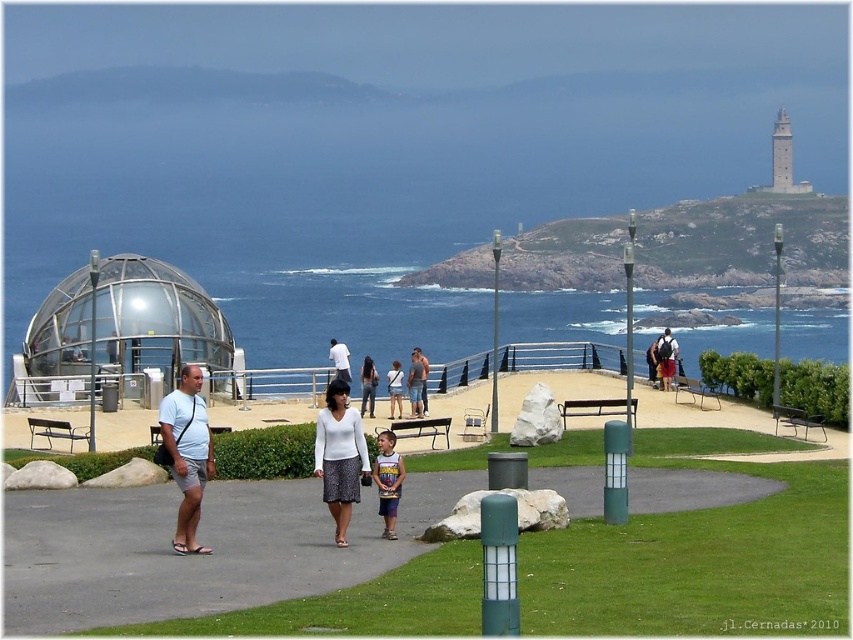
Which is more to the right, white matte sweater at center or striped t-shirt at center?

Positioned to the right is striped t-shirt at center.

Does white matte sweater at center come behind striped t-shirt at center?

No.

Between point (332, 429) and point (399, 472), which one is positioned in front?

Positioned in front is point (399, 472).

Locate an element on the screen. Image resolution: width=853 pixels, height=640 pixels. white matte sweater at center is located at coordinates (339, 456).

Which is in front, point (183, 472) or point (381, 467)?

Point (183, 472)

Is point (184, 512) farther from camera compared to point (393, 461)?

That is False.

You are a GUI agent. You are given a task and a screenshot of the screen. Output one action in this format:
    pyautogui.click(x=<x>, y=<y>)
    Task: Click on the white cotton t-shirt at center
    
    Given the screenshot: What is the action you would take?
    pyautogui.click(x=187, y=452)

What are the coordinates of `white cotton t-shirt at center` in the screenshot? It's located at (187, 452).

Who is positioned more to the left, white cotton t-shirt at center or white matte sweater at center?

From the viewer's perspective, white cotton t-shirt at center appears more on the left side.

This screenshot has height=640, width=853. Describe the element at coordinates (187, 452) in the screenshot. I see `white cotton t-shirt at center` at that location.

Which is in front, point (194, 490) or point (339, 388)?

Point (194, 490) is in front.

Identify the location of white cotton t-shirt at center. The image size is (853, 640). (187, 452).